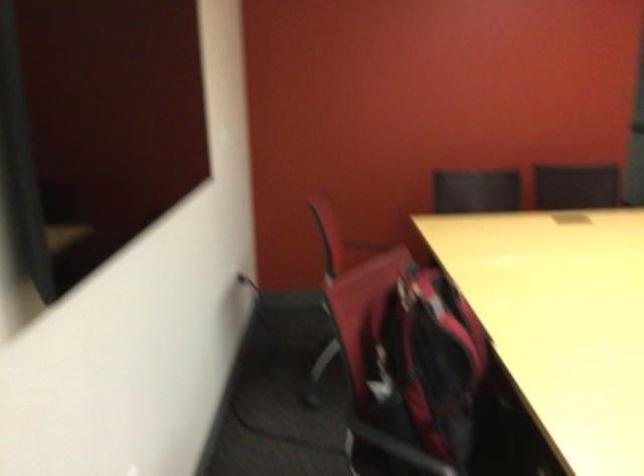
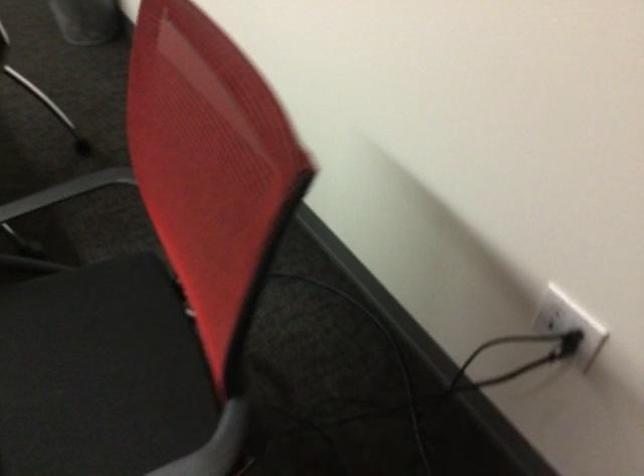
Locate, in the second image, the point that corresponds to [245,270] in the first image.

(554, 312)